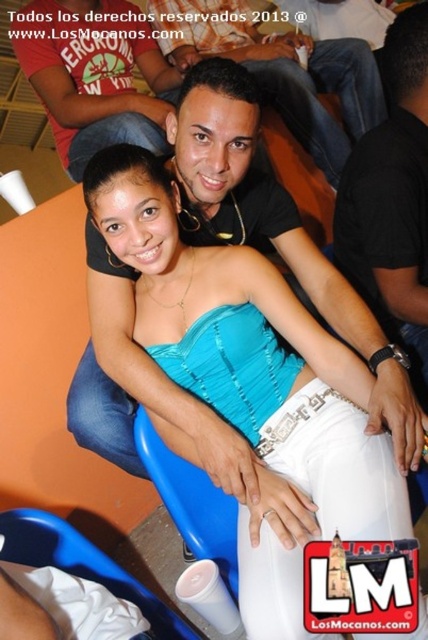
You are standing at the origin point in the image and want to move towards the two points labeled point (204, 352) and point (421, 90). Which point will you encounter first?

Point (204, 352) is in front of point (421, 90), so you will encounter point (204, 352) first.

Consider the image. You are planning to take a photo of the black matte shirt at upper center and the blue plastic chair at lower center. Which object is narrower?

The black matte shirt at upper center is narrower than the blue plastic chair at lower center.